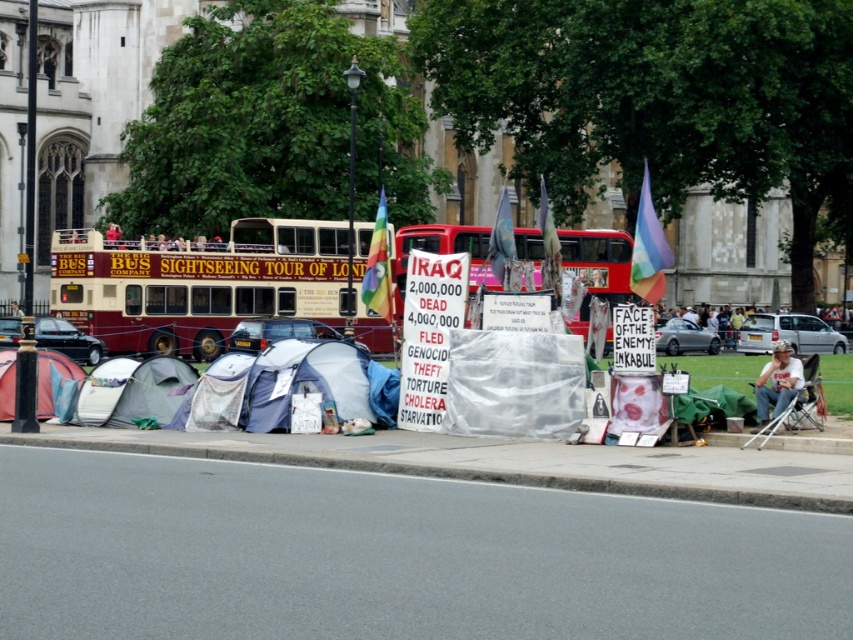
Who is more forward, [193,250] or [579,332]?

Point [579,332] is more forward.

Does maroon fabric double-decker bus at left appear on the left side of maroon fabric double-decker bus at center?

Yes, maroon fabric double-decker bus at left is to the left of maroon fabric double-decker bus at center.

At what (x,y) coordinates should I click in order to perform the action: click on maroon fabric double-decker bus at left. Please return your answer as a coordinate pair (x, y). Looking at the image, I should click on [198, 284].

Is concrete curb at lower center shorter than red fabric tent at lower left?

Indeed, concrete curb at lower center has a lesser height compared to red fabric tent at lower left.

Based on the photo, who is more distant from viewer, (370, 461) or (61, 358)?

The point (61, 358) is more distant.

Measure the distance between point [683,452] and camera.

A distance of 17.96 meters exists between point [683,452] and camera.

Locate an element on the screen. The width and height of the screenshot is (853, 640). concrete curb at lower center is located at coordinates (x=509, y=461).

Does maroon fabric double-decker bus at center have a greater height compared to red fabric tent at lower left?

Yes.

Between maroon fabric double-decker bus at center and red fabric tent at lower left, which one has more height?

maroon fabric double-decker bus at center

Does point (463, 252) come farther from viewer compared to point (1, 396)?

Yes, point (463, 252) is behind point (1, 396).

The height and width of the screenshot is (640, 853). I want to click on maroon fabric double-decker bus at center, so click(596, 268).